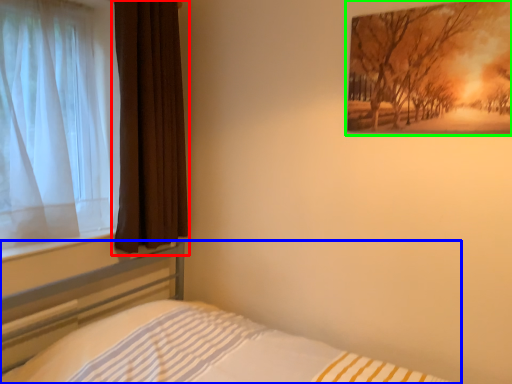
Question: Which is farther away from curtain (highlighted by a red box)? bed (highlighted by a blue box) or picture frame (highlighted by a green box)?

Choices:
 (A) bed
 (B) picture frame

Answer: (B)